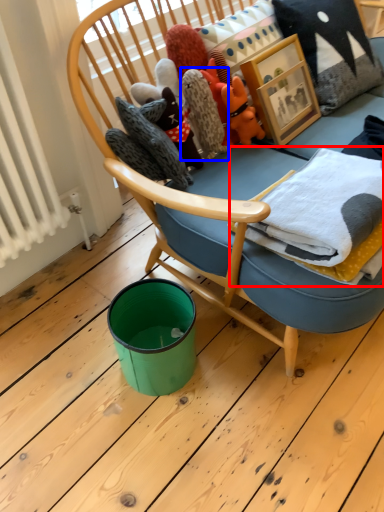
Question: Which object is closer to the camera taking this photo, material (highlighted by a red box) or cloth (highlighted by a blue box)?

Choices:
 (A) material
 (B) cloth

Answer: (A)